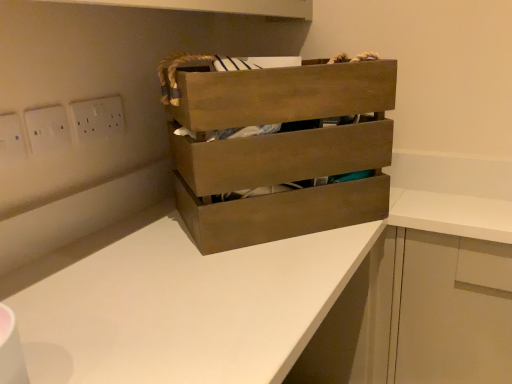
Question: Can you confirm if white matte counter at center is shorter than white matte cabinet at lower right?

Choices:
 (A) yes
 (B) no

Answer: (B)

Question: Can you confirm if white matte counter at center is thinner than white matte cabinet at lower right?

Choices:
 (A) yes
 (B) no

Answer: (B)

Question: Would you say white matte cabinet at lower right is part of white matte counter at center's contents?

Choices:
 (A) no
 (B) yes

Answer: (A)

Question: Would you say white matte counter at center is a long distance from white matte cabinet at lower right?

Choices:
 (A) yes
 (B) no

Answer: (B)

Question: Is white matte counter at center facing towards white matte cabinet at lower right?

Choices:
 (A) yes
 (B) no

Answer: (B)

Question: Considering their positions, is white matte counter at center located in front of or behind white plastic switch at upper left, the 2th electric outlet in the left-to-right sequence?

Choices:
 (A) front
 (B) behind

Answer: (A)

Question: Considering the positions of white matte counter at center and white plastic switch at upper left, the second electric outlet when ordered from right to left, in the image, is white matte counter at center taller or shorter than white plastic switch at upper left, the second electric outlet when ordered from right to left,?

Choices:
 (A) tall
 (B) short

Answer: (A)

Question: Considering the relative positions of white matte counter at center and white plastic switch at upper left, positioned as the 2th electric outlet in back-to-front order, in the image provided, is white matte counter at center to the left or to the right of white plastic switch at upper left, positioned as the 2th electric outlet in back-to-front order,?

Choices:
 (A) right
 (B) left

Answer: (A)

Question: Is white matte counter at center inside the boundaries of white plastic switch at upper left, the second electric outlet when ordered from right to left, or outside?

Choices:
 (A) outside
 (B) inside

Answer: (A)

Question: Considering the positions of point (477, 307) and point (225, 231), is point (477, 307) closer or farther from the camera than point (225, 231)?

Choices:
 (A) farther
 (B) closer

Answer: (A)

Question: From the image's perspective, is white matte counter at center above or below wooden crate at center?

Choices:
 (A) above
 (B) below

Answer: (B)

Question: From a real-world perspective, relative to wooden crate at center, is white matte counter at center vertically above or below?

Choices:
 (A) above
 (B) below

Answer: (B)

Question: Is white matte counter at center taller or shorter than wooden crate at center?

Choices:
 (A) tall
 (B) short

Answer: (A)

Question: Considering their positions, is white plastic electric outlet at upper left, which ranks as the third electric outlet in front-to-back order, located in front of or behind white matte cabinet at lower right?

Choices:
 (A) behind
 (B) front

Answer: (A)

Question: Is white plastic electric outlet at upper left, placed as the third electric outlet when sorted from left to right, taller or shorter than white matte cabinet at lower right?

Choices:
 (A) short
 (B) tall

Answer: (A)